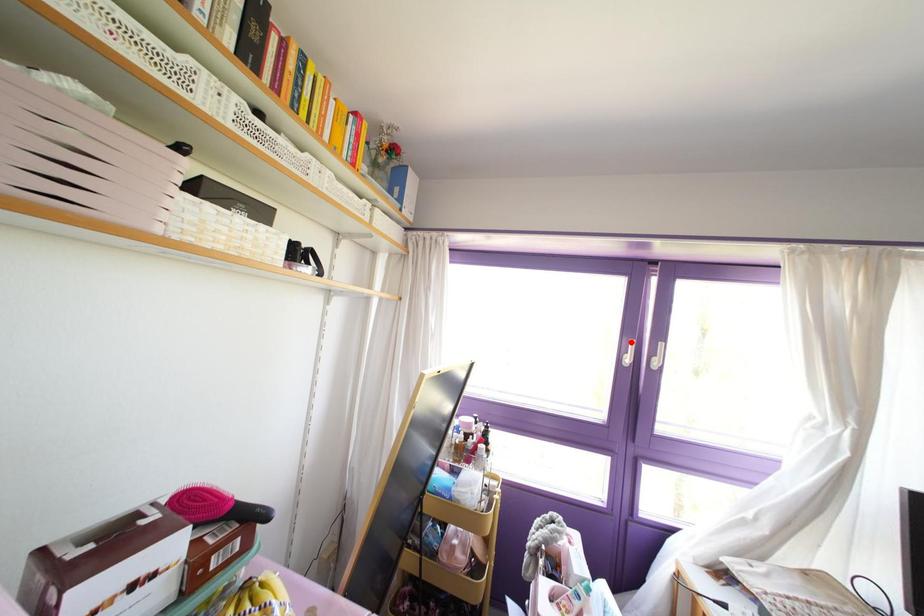
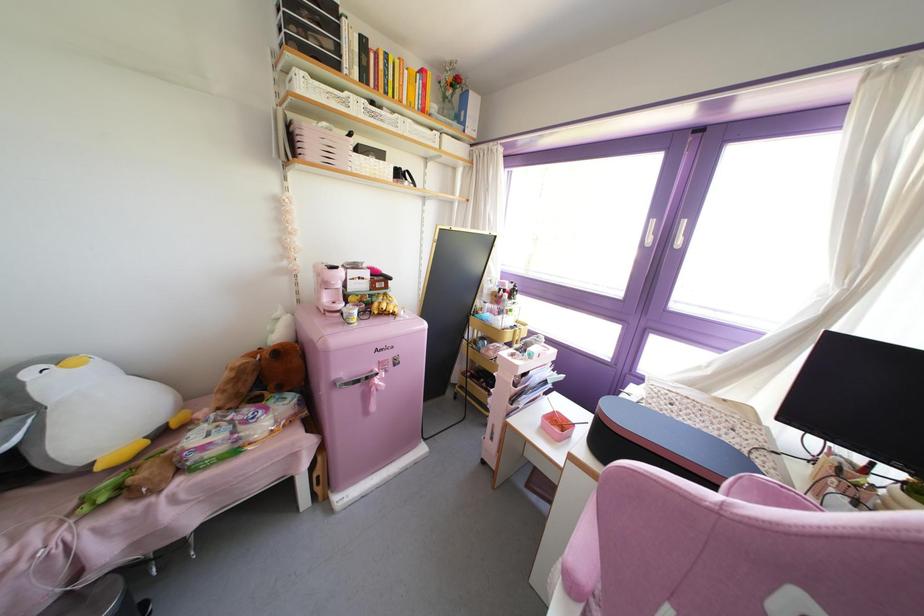
In the second image, find the point that corresponds to the highlighted location in the first image.

(652, 222)